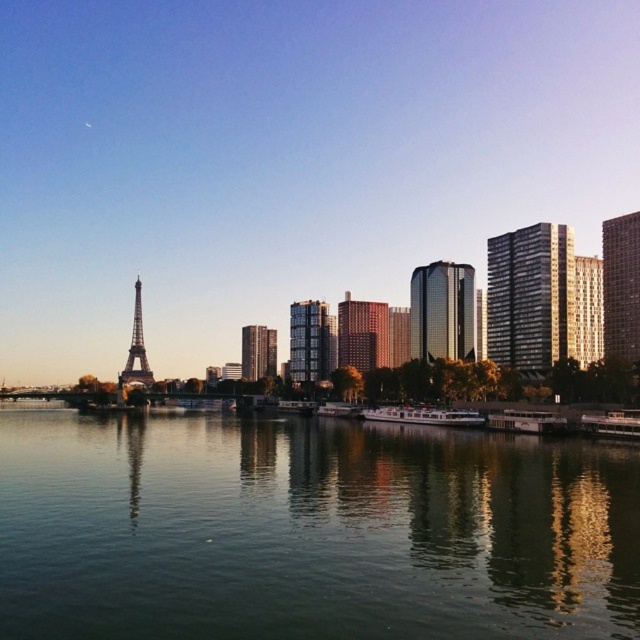
You are an architect designing a new park in this area. You want to ensure that the view of the Eiffel Tower isn not obstructed by the dark gray glass building at right and the glassy reflective skyscraper at center. Which building poses a greater risk of blocking the Eiffel Tower view?

The glassy reflective skyscraper at center is taller than the dark gray glass building at right, so it poses a greater risk of blocking the Eiffel Tower view.

You are a tourist standing on the riverside and want to take a photo that includes both the shiny glass skyscraper at center right and the metallic silver boat at lower right. Based on their sizes in the image, which object should you position closer to the center of your camera frame to ensure both are clearly visible?

The shiny glass skyscraper at center right is larger in size compared to the metallic silver boat at lower right. To ensure both are clearly visible in the photo, position the shiny glass skyscraper at center right closer to the center of your camera frame since its larger size will occupy more space, allowing the metallic silver boat at lower right to fit within the frame without being too small.

You are an architect analyzing this urban scene. You need to determine the spatial relationship between the dark gray glass building at right and the glassy reflective skyscraper at center. Based on the scene, which building is closer to the viewer?

The dark gray glass building at right is closer to the viewer than the glassy reflective skyscraper at center because it is positioned in front of it.